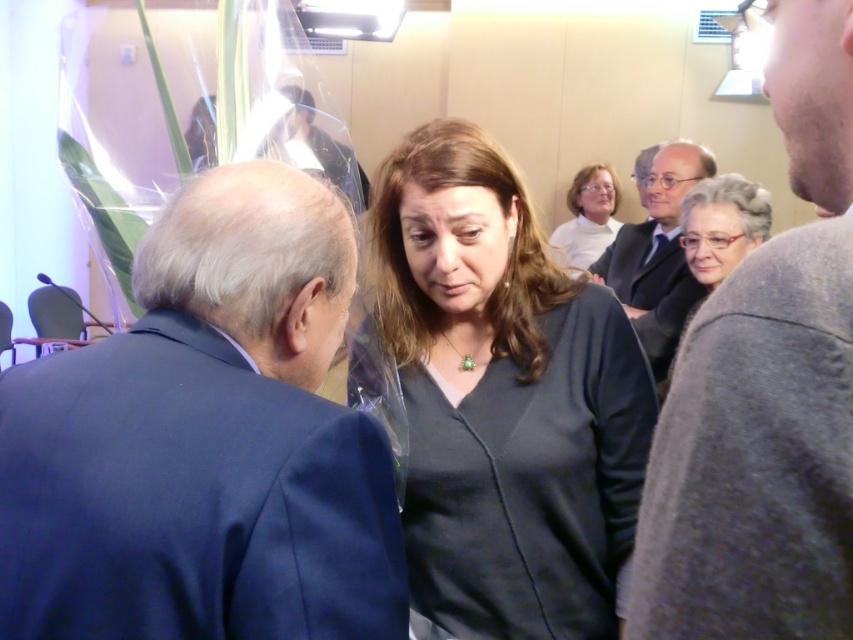
Between matte black shirt at center and gray woolen sweater at upper right, which one is positioned higher?

gray woolen sweater at upper right is higher up.

Is matte black shirt at center above gray woolen sweater at upper right?

Actually, matte black shirt at center is below gray woolen sweater at upper right.

Where is `matte black shirt at center`? The image size is (853, 640). matte black shirt at center is located at coordinates (503, 400).

Is gray woolen coat at right taller than white matte shirt at upper center?

Yes.

How distant is gray woolen coat at right from white matte shirt at upper center?

2.22 meters

Identify the location of gray woolen coat at right. This screenshot has width=853, height=640. (722, 225).

Is the position of dark gray suit at upper right less distant than that of white matte shirt at upper center?

Yes, it is.

Who is more forward, (619, 230) or (569, 220)?

Point (619, 230) is in front.

The height and width of the screenshot is (640, 853). What do you see at coordinates (656, 253) in the screenshot?
I see `dark gray suit at upper right` at bounding box center [656, 253].

Locate an element on the screen. dark gray suit at upper right is located at coordinates (656, 253).